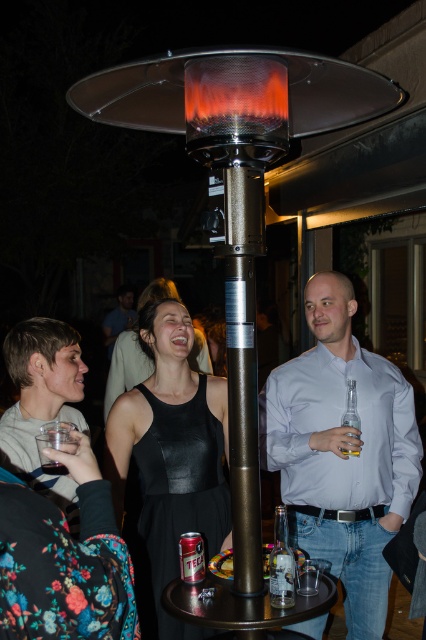
You are at a party and want to grab a drink from the clear glass bottle at right without disturbing the person in the matte gray shirt at center. Can you reach the bottle without moving the shirt?

The matte gray shirt at center is located above the clear glass bottle at right, so you can reach the bottle without moving the shirt since it is below.

You are standing at the origin point of the coordinate system. You want to move towards the matte gray shirt at center. Which direction should you move in?

The matte gray shirt at center is located at coordinate point 0.631 on the x axis and 0.101 on the y axis. Since you are at the origin point, you should move towards the positive x and positive y direction to reach the matte gray shirt at center.

In the scene shown: You are a waiter at the outdoor gathering. You need to deliver a drink to the metallic silver pole at center where the guests are gathered. The clear glass bottle at right contains the drink. Can you reach the bottle from your current position 5 feet away from the pole?

The metallic silver pole at center and clear glass bottle at right are 3.37 feet apart. Since you are 5 feet away from the pole, the bottle is 3.37 feet away from the pole, so you are farther than the bottle. You need to move closer to reach it.